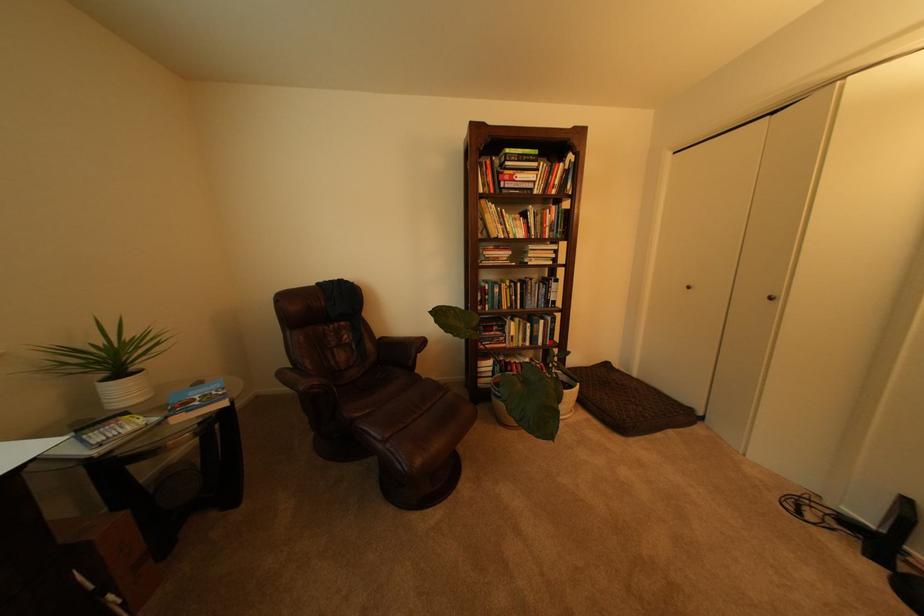
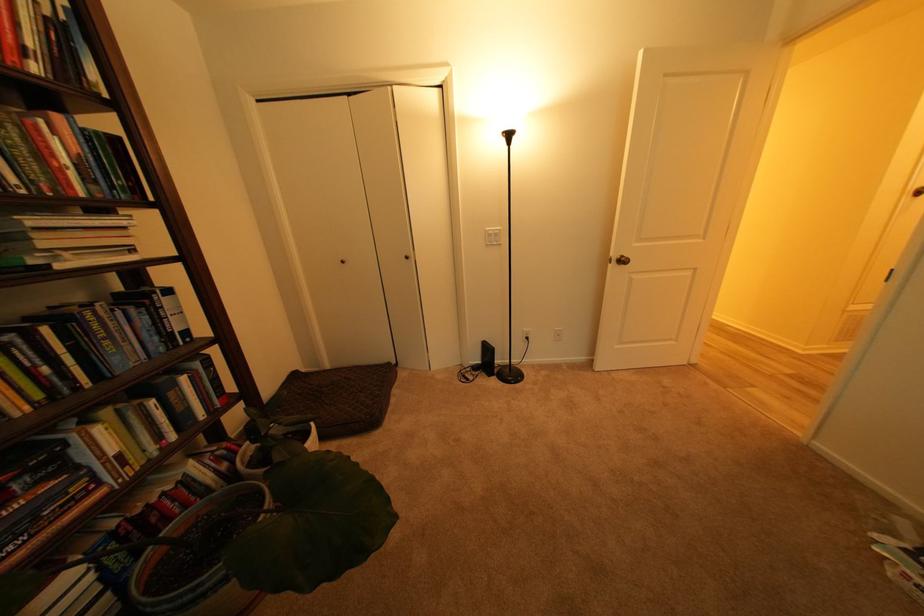
The point at (777, 298) is marked in the first image. Where is the corresponding point in the second image?

(416, 257)